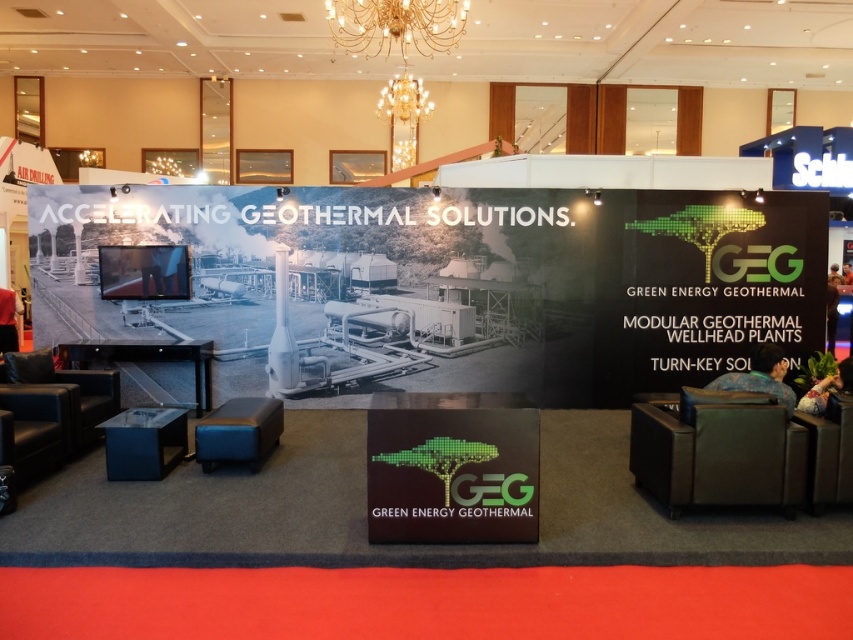
You are at the Green Energy Geothermal booth and need to locate both the green matte sign at center and the gold metallic chandelier at upper center. According to the layout, which object is positioned to the right of the other?

The green matte sign at center is to the right of the gold metallic chandelier at upper center.

You are standing at the entrance of the GEG booth and want to touch both points in the image. Which point should you reach for first, point at coordinate (434, 540) or point at coordinate (407, 100)?

You should reach for point at coordinate (434, 540) first because it is closer to you than point at coordinate (407, 100).